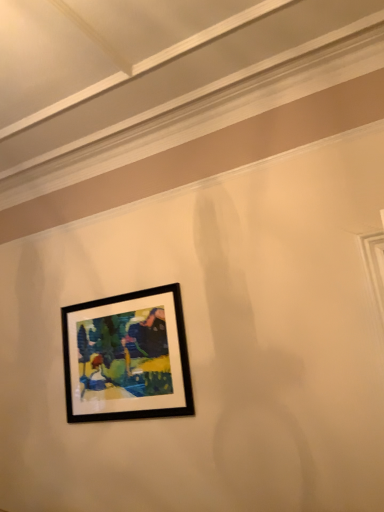
Find the location of a particular element. black matte picture frame at upper left is located at coordinates (127, 357).

What do you see at coordinates (127, 357) in the screenshot? Image resolution: width=384 pixels, height=512 pixels. I see `black matte picture frame at upper left` at bounding box center [127, 357].

This screenshot has height=512, width=384. In order to click on black matte picture frame at upper left in this screenshot , I will do `click(127, 357)`.